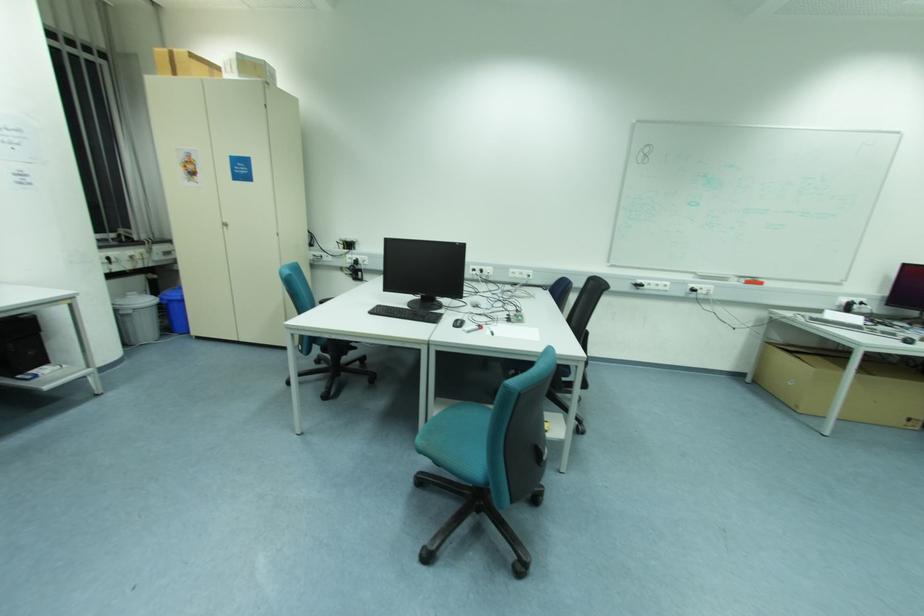
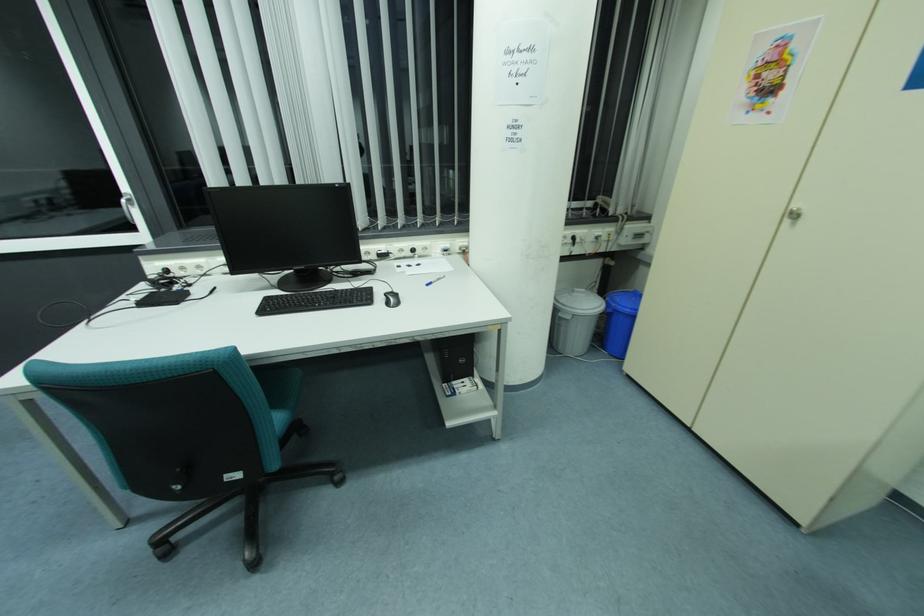
Where in the second image is the point corresponding to the point at 226,225 from the first image?

(795, 216)